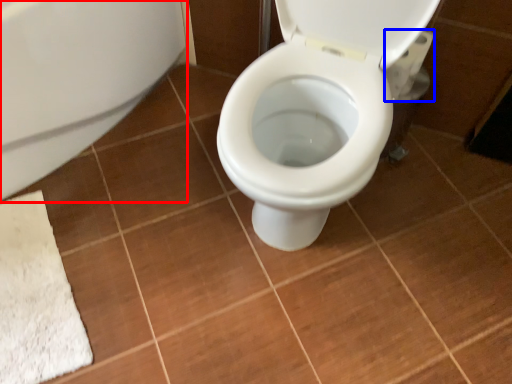
Question: Which of the following is the closest to the observer, bath (highlighted by a red box) or toilet paper (highlighted by a blue box)?

Choices:
 (A) bath
 (B) toilet paper

Answer: (A)